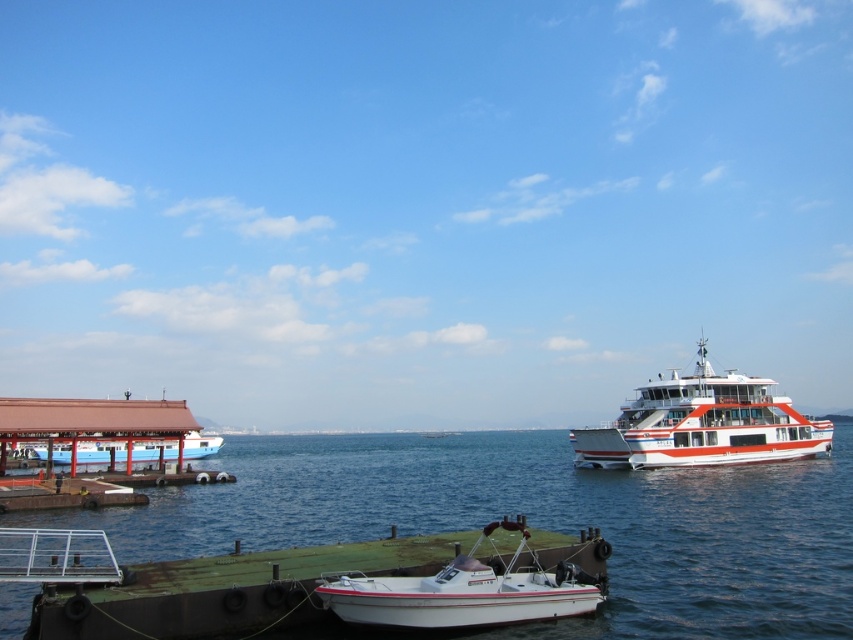
You are standing on the light blue wooden dock at left and want to board the white glossy ferry at right. Which direction should you walk to reach the ferry?

Since the white glossy ferry at right is further to the viewer than the light blue wooden dock at left, you should walk towards the direction of the ferry, which is closer to you, to board it.

You are standing on the dock and want to know which of the two points, point (117, 538) or point (758, 387), is closer to you. Can you determine this based on the scene?

Point (117, 538) is closer to the viewer than point (758, 387), so it is closer to you.